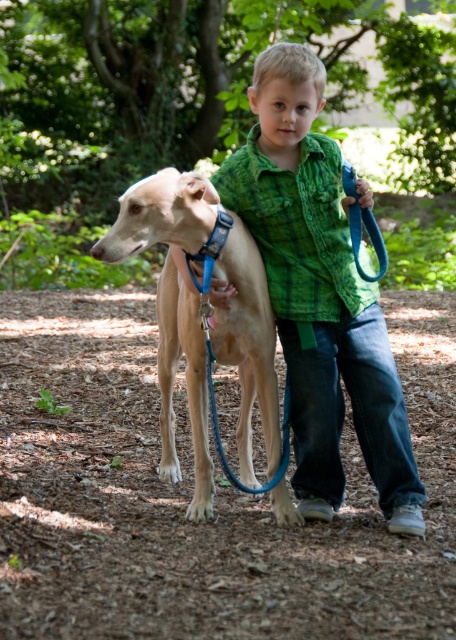
In the scene shown: You are a photographer setting up a shot of the boy and his dog. The camera frame is currently centered on the green plaid shirt at center and light brown fur at center. To ensure both subjects are fully visible, which one should you adjust the frame to focus on first considering their sizes?

The green plaid shirt at center has a larger width than the light brown fur at center, so you should adjust the frame to focus on the green plaid shirt at center first to accommodate its size.

The boy is wearing a green plaid shirt at center and has a light brown fur at center. Which one is taller?

The green plaid shirt at center is taller than the light brown fur at center.